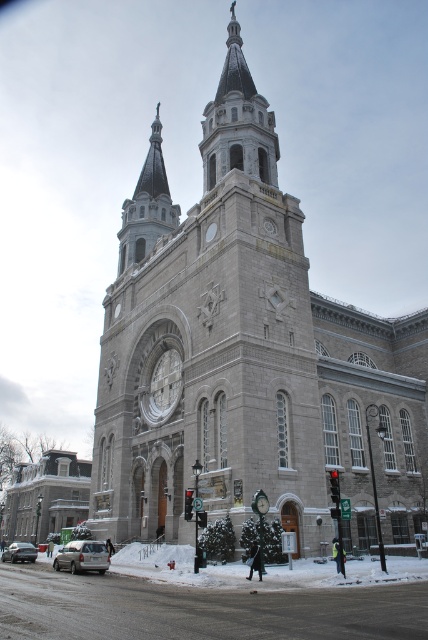
You are a photographer trying to capture the gray stone church at center and the silver metallic suv at lower left in a single frame. Given that the church is much larger than the suv, how might you position your camera to emphasize the size difference between them?

To emphasize the size difference between the gray stone church at center and the silver metallic suv at lower left, position the camera closer to the silver metallic suv at lower left. This will make the suv appear larger in the frame relative to the distant gray stone church at center, highlighting their size contrast.